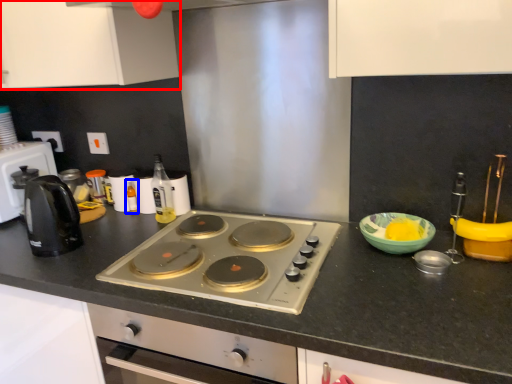
Question: Which of the following is the closest to the observer, cabinetry (highlighted by a red box) or bottle (highlighted by a blue box)?

Choices:
 (A) cabinetry
 (B) bottle

Answer: (A)